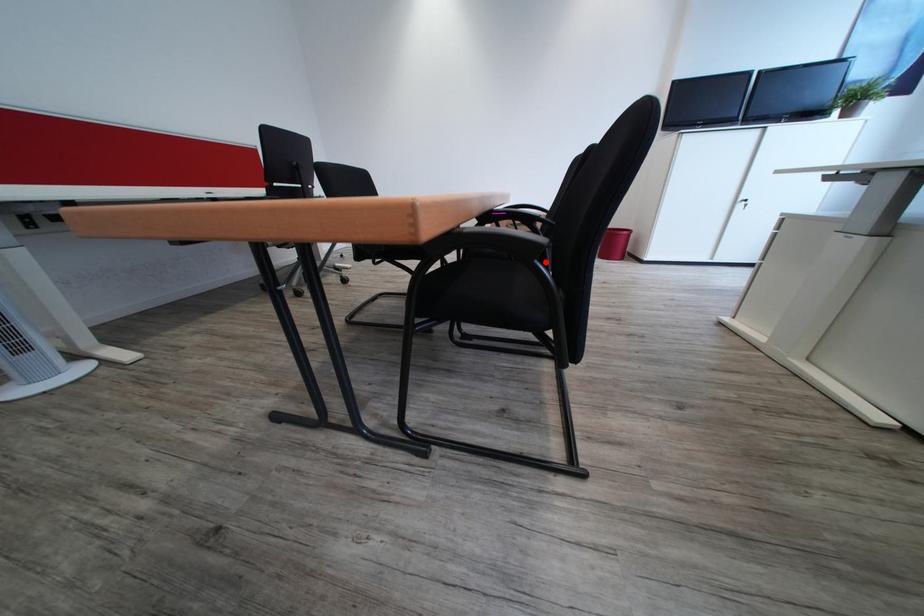
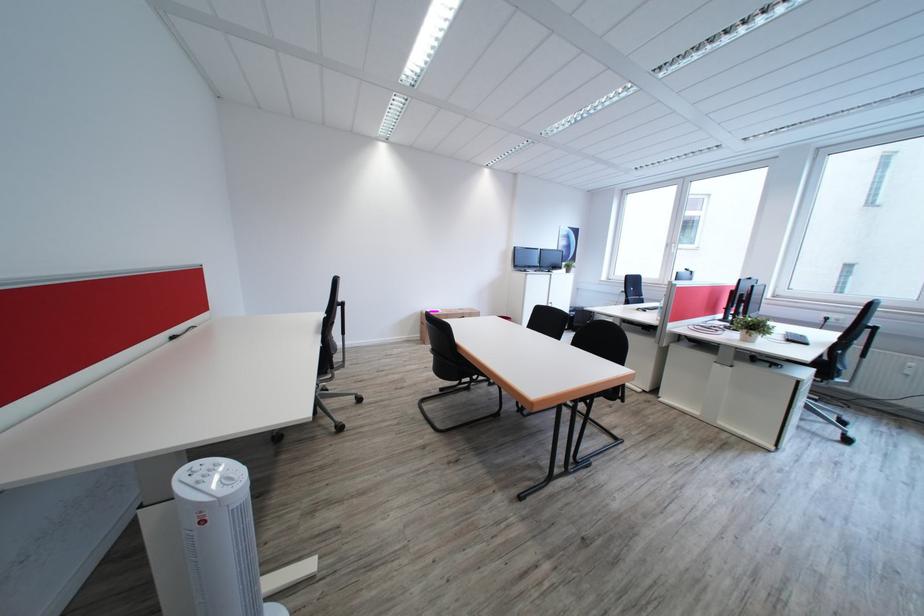
Question: I am providing you with two images of the same scene from different viewpoints. A red point is marked on the first image. Is the red point's position out of view in image 2?

Choices:
 (A) Yes
 (B) No

Answer: (A)